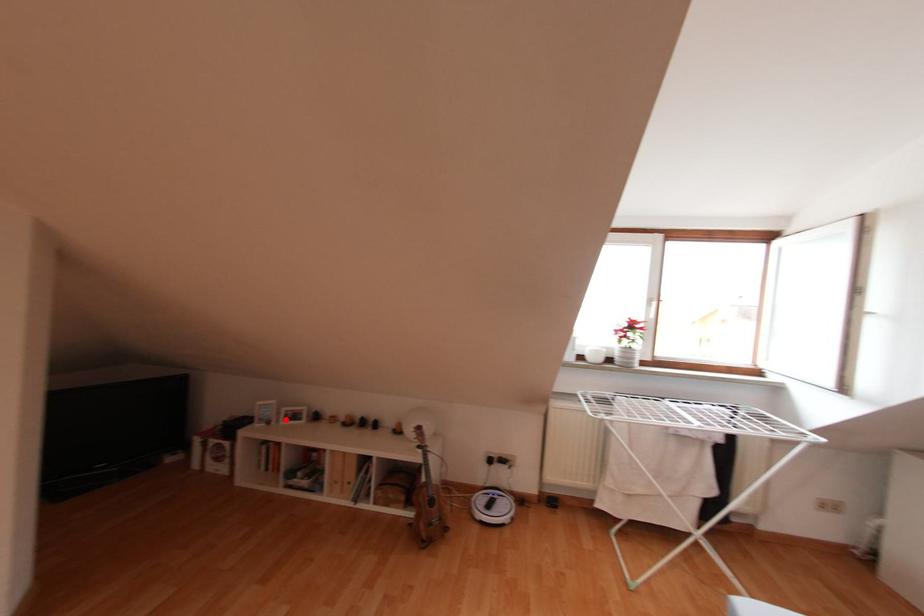
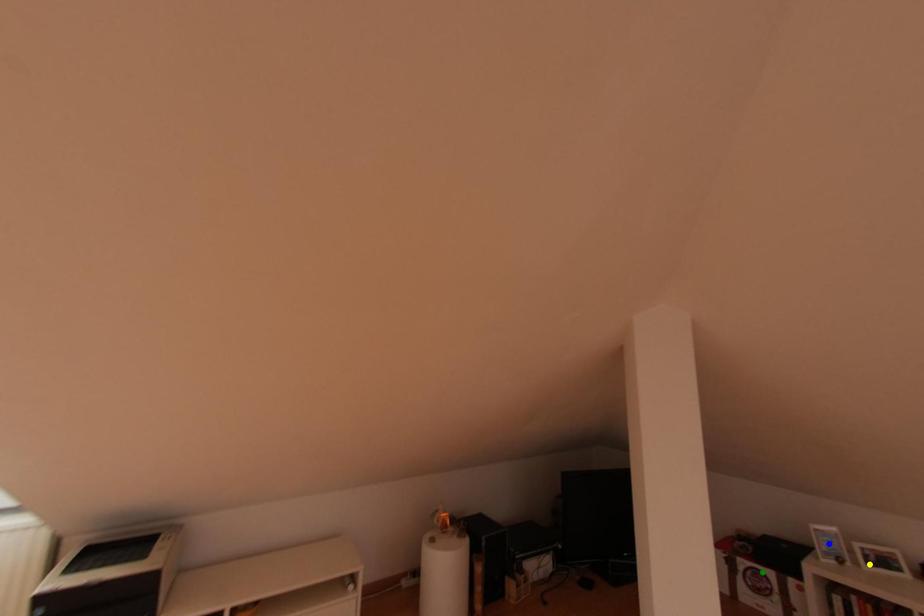
Question: I am providing you with two images of the same scene from different viewpoints. A red point is marked on the first image. You are given multiple points on the second image. Can you choose the point in image 2 that corresponds to the point in image 1?

Choices:
 (A) yellow point
 (B) green point
 (C) blue point

Answer: (A)